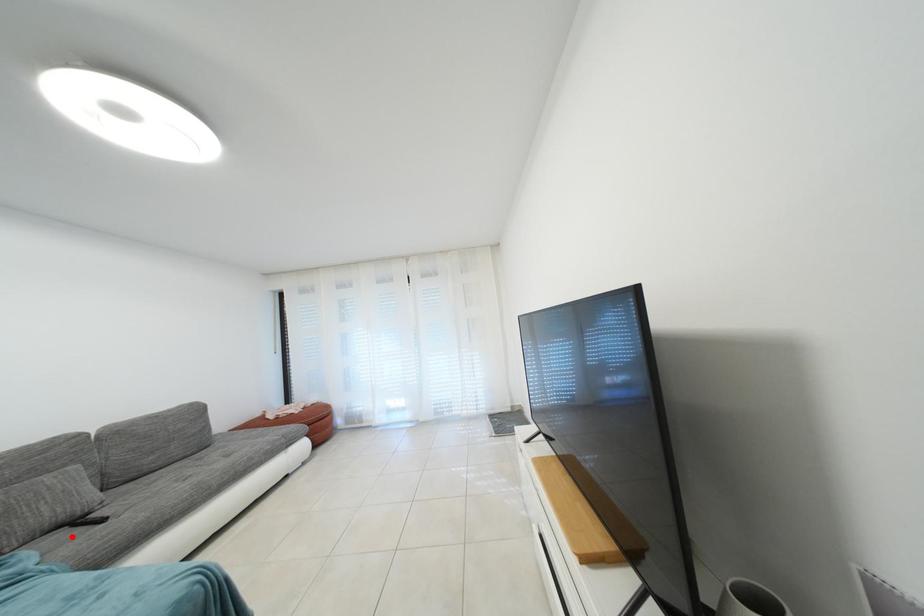
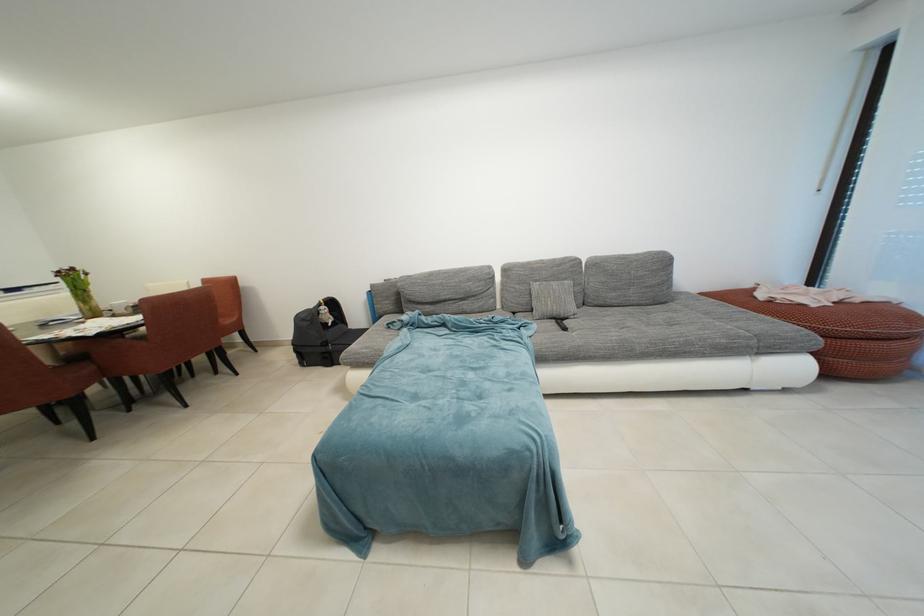
The point at the highlighted location is marked in the first image. Where is the corresponding point in the second image?

(560, 328)